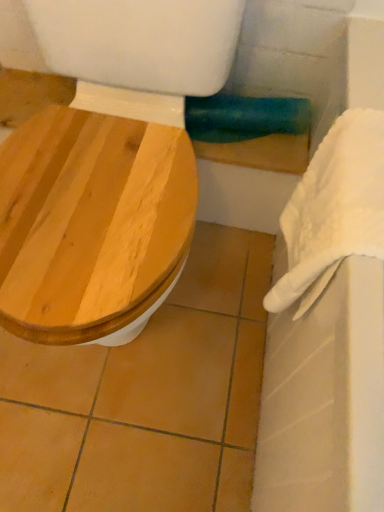
Question: Is white fabric towel bar at upper right situated inside wooden toilet seat at left or outside?

Choices:
 (A) inside
 (B) outside

Answer: (B)

Question: From a real-world perspective, is white fabric towel bar at upper right above or below wooden toilet seat at left?

Choices:
 (A) below
 (B) above

Answer: (A)

Question: Which object is positioned farthest from the white fluffy towel at right?

Choices:
 (A) wooden toilet seat at left
 (B) white fabric towel bar at upper right

Answer: (B)

Question: Which object is positioned closest to the white fluffy towel at right?

Choices:
 (A) wooden toilet seat at left
 (B) white fabric towel bar at upper right

Answer: (A)